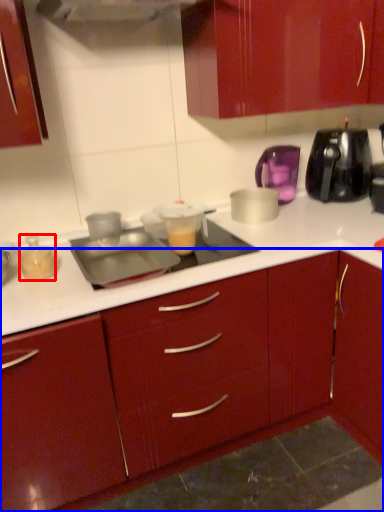
Question: Which object appears farthest to the camera in this image, kitchen appliance (highlighted by a red box) or cabinetry (highlighted by a blue box)?

Choices:
 (A) kitchen appliance
 (B) cabinetry

Answer: (A)